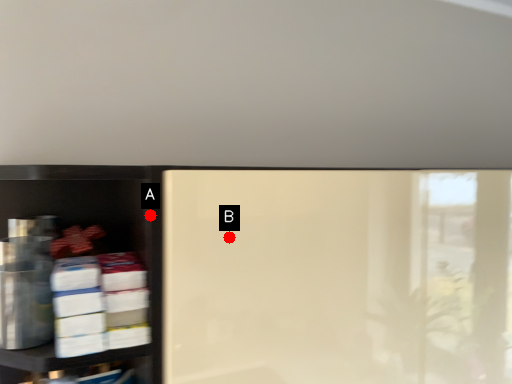
Question: Two points are circled on the image, labeled by A and B beside each circle. Which point is further to the camera?

Choices:
 (A) A is further
 (B) B is further

Answer: (B)